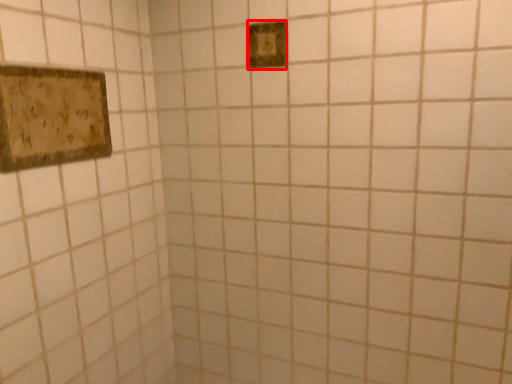
Question: From the image's perspective, where is light switch (annotated by the red box) located in relation to picture frame in the image?

Choices:
 (A) above
 (B) below

Answer: (A)